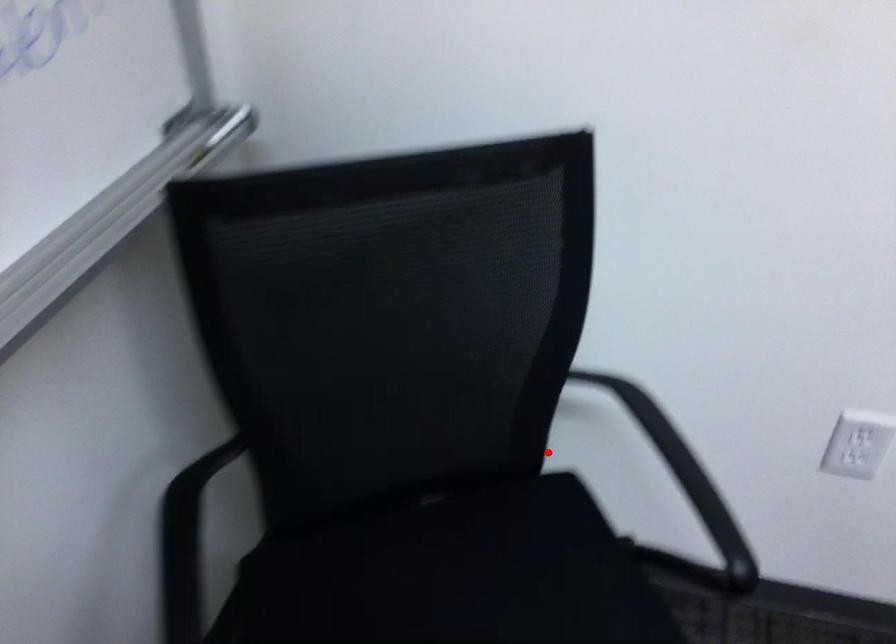
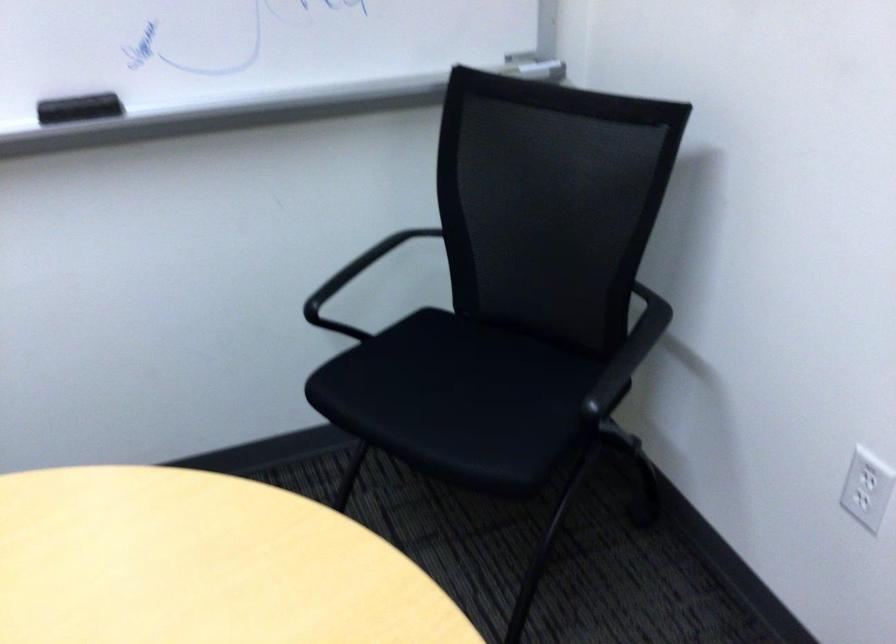
Find the pixel in the second image that matches the highlighted location in the first image.

(673, 399)